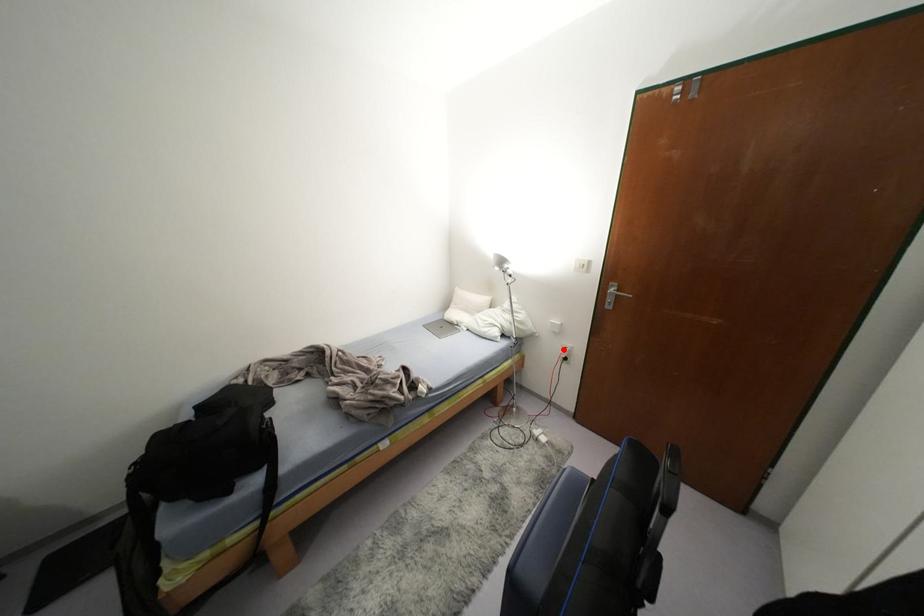
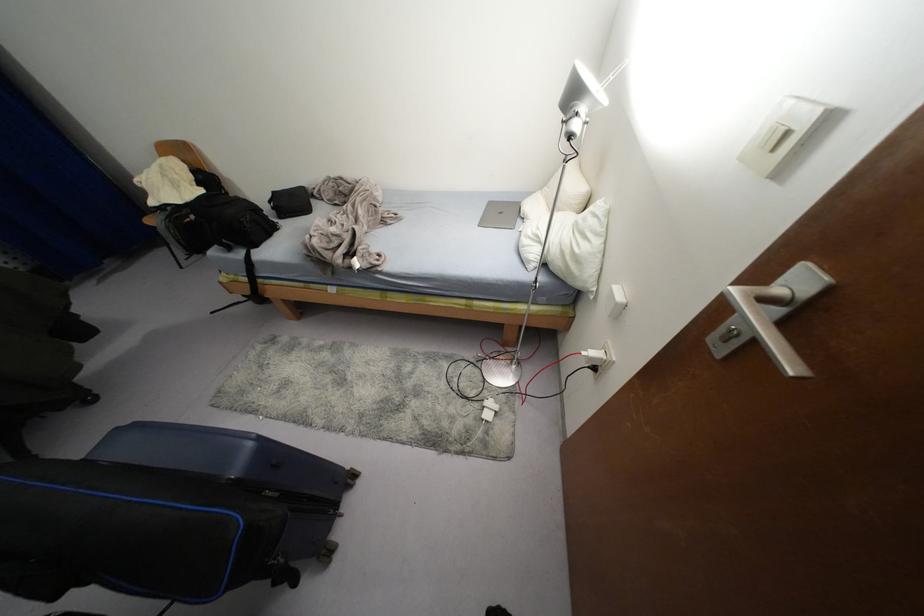
Question: I am providing you with two images of the same scene from different viewpoints. In image1, a red point is highlighted. Considering the same 3D point in image2, which of the following is correct?

Choices:
 (A) It is closer
 (B) It is farther

Answer: (A)